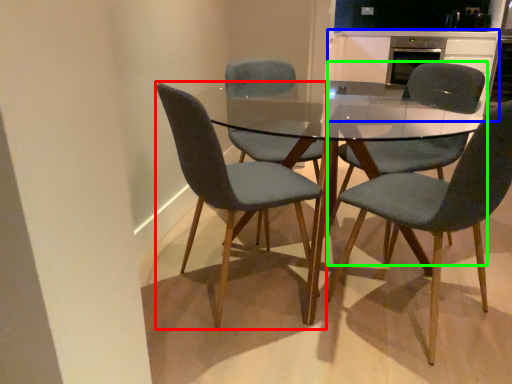
Question: Which object is the closest to the chair (highlighted by a red box)? Choose among these: cabinetry (highlighted by a blue box) or chair (highlighted by a green box).

Choices:
 (A) cabinetry
 (B) chair

Answer: (B)